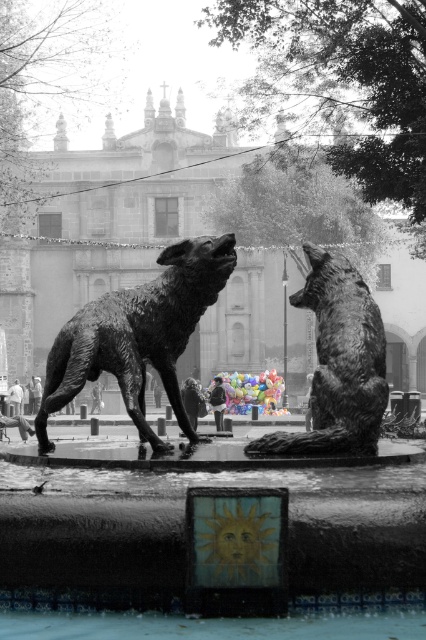
Based on the photo, who is shorter, bronze statue at center or bronze statue of a howling dog at center?

With less height is bronze statue of a howling dog at center.

Between bronze statue at center and bronze statue of a howling dog at center, which one has more height?

With more height is bronze statue at center.

Which is behind, point (60, 468) or point (155, 340)?

The point (155, 340) is more distant.

Identify the location of bronze statue at center. The image size is (426, 640). (183, 524).

Can you confirm if bronze statue of a howling dog at center is positioned to the left of bronze wolf at center?

Correct, you'll find bronze statue of a howling dog at center to the left of bronze wolf at center.

Measure the distance between bronze statue of a howling dog at center and camera.

bronze statue of a howling dog at center and camera are 26.86 meters apart from each other.

Image resolution: width=426 pixels, height=640 pixels. Identify the location of bronze statue of a howling dog at center. (138, 336).

Between point (124, 516) and point (354, 275), which one is positioned in front?

Point (124, 516) is more forward.

Who is more distant from viewer, (8, 476) or (324, 252)?

The point (324, 252) is more distant.

Where is `bronze statue at center`? This screenshot has height=640, width=426. bronze statue at center is located at coordinates (183, 524).